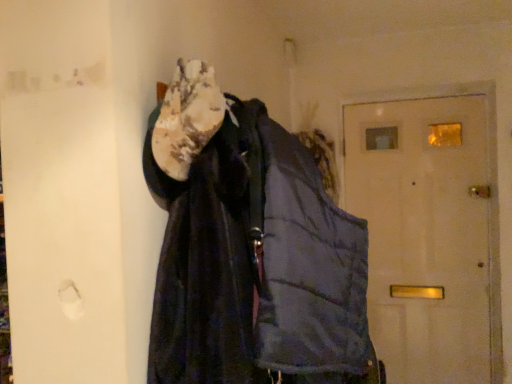
Question: From their relative heights in the image, would you say white fuzzy scarf at upper center is taller or shorter than dark blue quilted jacket at center?

Choices:
 (A) tall
 (B) short

Answer: (B)

Question: Is white fuzzy scarf at upper center in front of or behind dark blue quilted jacket at center in the image?

Choices:
 (A) behind
 (B) front

Answer: (A)

Question: Which is nearer to the dark blue quilted jacket at center?

Choices:
 (A) white fuzzy scarf at upper center
 (B) white matte door at center

Answer: (A)

Question: Which object is the closest to the white matte door at center?

Choices:
 (A) white fuzzy scarf at upper center
 (B) dark blue quilted jacket at center

Answer: (B)